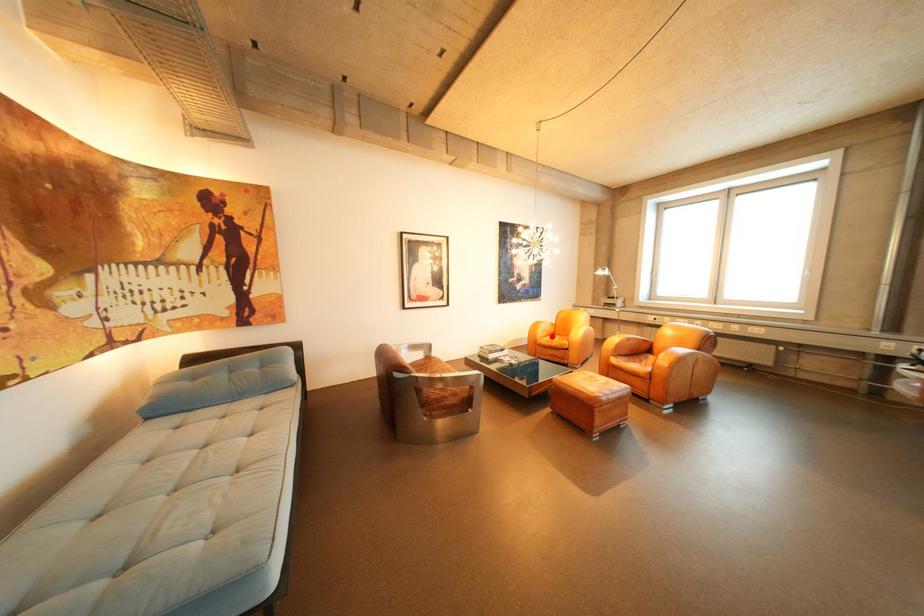
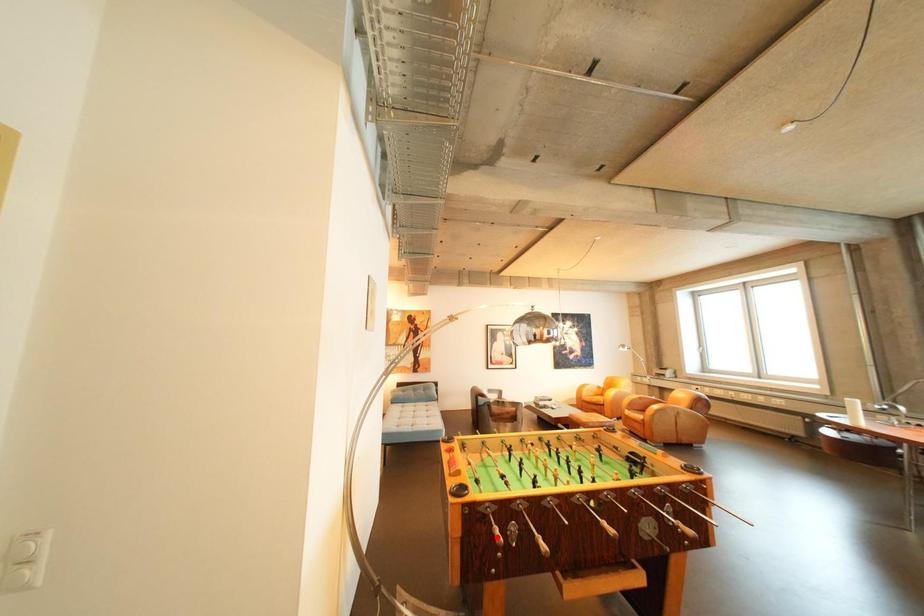
From the picture: I am providing you with two images of the same scene from different viewpoints. A red point is marked on the first image and another point is marked on the second image. Is the red point in image1 aligned with the point shown in image2?

No